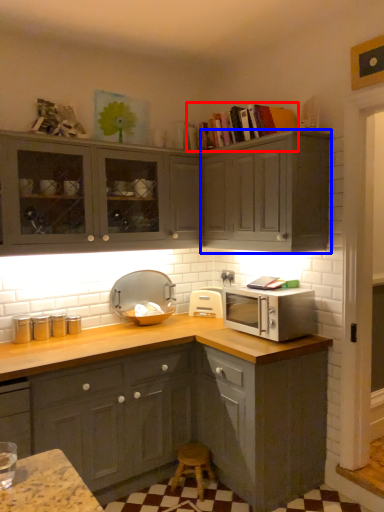
Question: Which of the following is the farthest to the observer, book (highlighted by a red box) or cabinetry (highlighted by a blue box)?

Choices:
 (A) book
 (B) cabinetry

Answer: (A)